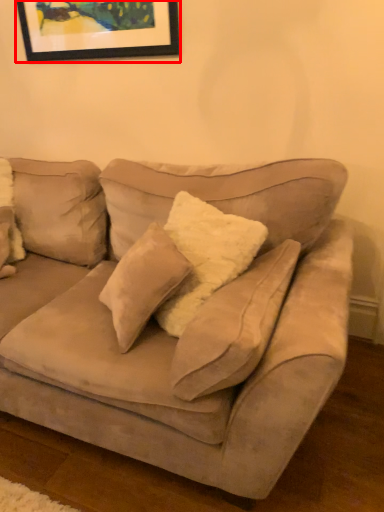
Question: From the image's perspective, where is picture frame (annotated by the red box) located relative to studio couch?

Choices:
 (A) above
 (B) below

Answer: (A)